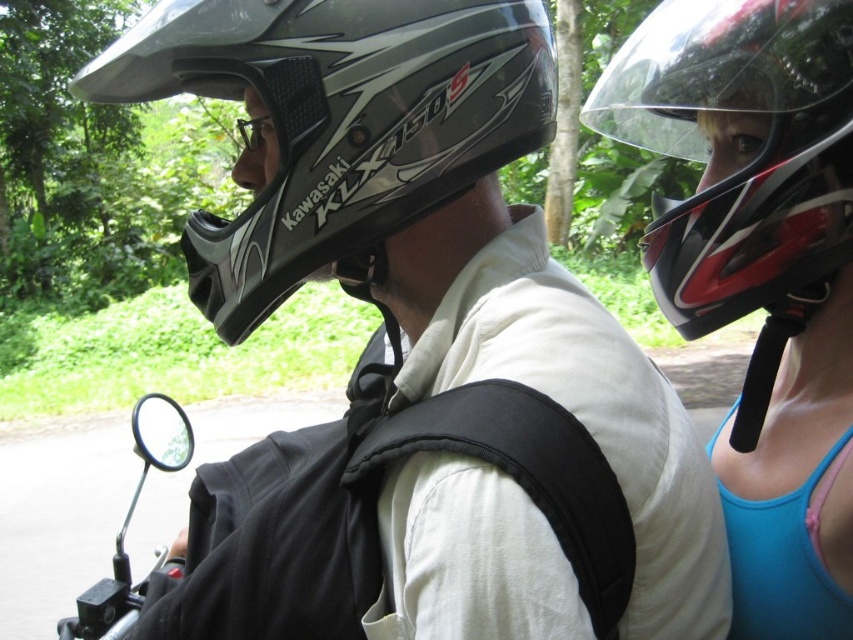
Find the location of a particular element. black fabric strap at center is located at coordinates (511, 477).

Between black fabric strap at center and clear plastic goggles at center, which one has more height?

clear plastic goggles at center

You are a GUI agent. You are given a task and a screenshot of the screen. Output one action in this format:
    pyautogui.click(x=<x>, y=<y>)
    Task: Click on the black fabric strap at center
    This screenshot has height=640, width=853.
    Given the screenshot: What is the action you would take?
    pyautogui.click(x=511, y=477)

Between shiny black helmet at upper right and clear plastic goggles at center, which one appears on the left side from the viewer's perspective?

Positioned to the left is clear plastic goggles at center.

Which is behind, point (846, 212) or point (236, 125)?

Positioned behind is point (236, 125).

Does point (791, 116) come farther from viewer compared to point (250, 138)?

No, it is not.

Where is `shiny black helmet at upper right`? This screenshot has height=640, width=853. shiny black helmet at upper right is located at coordinates (741, 166).

Which is in front, point (345, 70) or point (486, 412)?

Positioned in front is point (486, 412).

Does point (299, 276) come in front of point (354, 468)?

No.

Where is `shiny metallic helmet at center`? This screenshot has height=640, width=853. shiny metallic helmet at center is located at coordinates (338, 124).